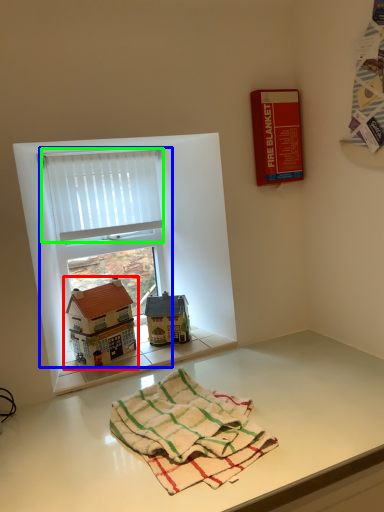
Question: Based on their relative distances, which object is nearer to toy (highlighted by a red box)? Choose from window (highlighted by a blue box) and curtain (highlighted by a green box).

Choices:
 (A) window
 (B) curtain

Answer: (A)